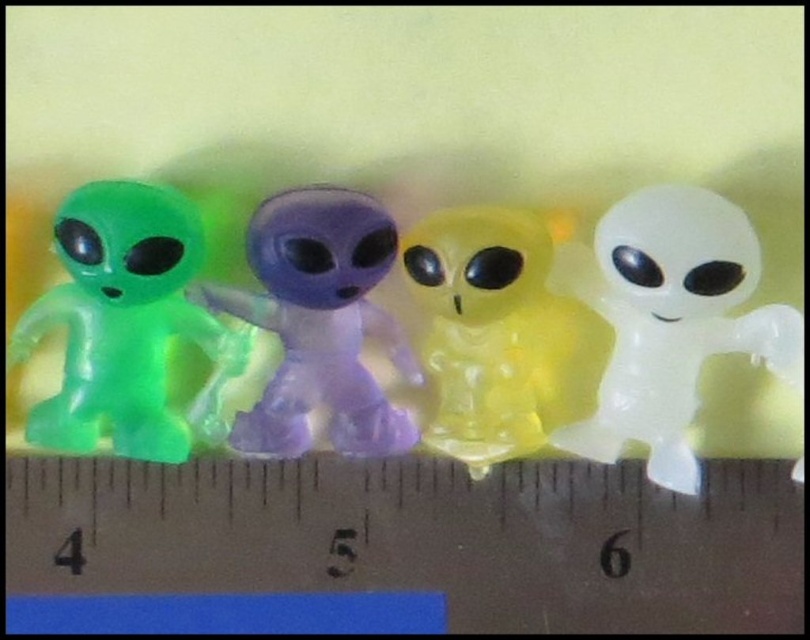
You are an alien collector who wants to display the transparent white alien at right and the green translucent alien at left on a shelf. If the shelf has a height limit of 3 inches, can both aliens fit vertically?

The transparent white alien at right is larger than the green translucent alien at left. However, the scene description mentions a ruler showing measurements from 4 to 6 inches, which likely indicates the height of the aliens. Since the shelf has a 3 inch height limit, both aliens exceed this limit and cannot fit vertically.

You are an alien collector who wants to arrange your collection in order from left to right. You have a green translucent alien at left and a translucent purple alien at center. According to the image, which alien should be placed first on the left side?

The green translucent alien at left should be placed first on the left side because it is positioned to the left of the translucent purple alien at center in the image.

You are an alien collector who wants to place the transparent white alien at right and the green translucent alien at left into a display case. The case has a width of 5 inches. Can both aliens fit side by side without overlapping?

The transparent white alien at right might be wider than green translucent alien at left, so there is a possibility that the total width of both exceeds 5 inches. Therefore, they might not fit side by side without overlapping.